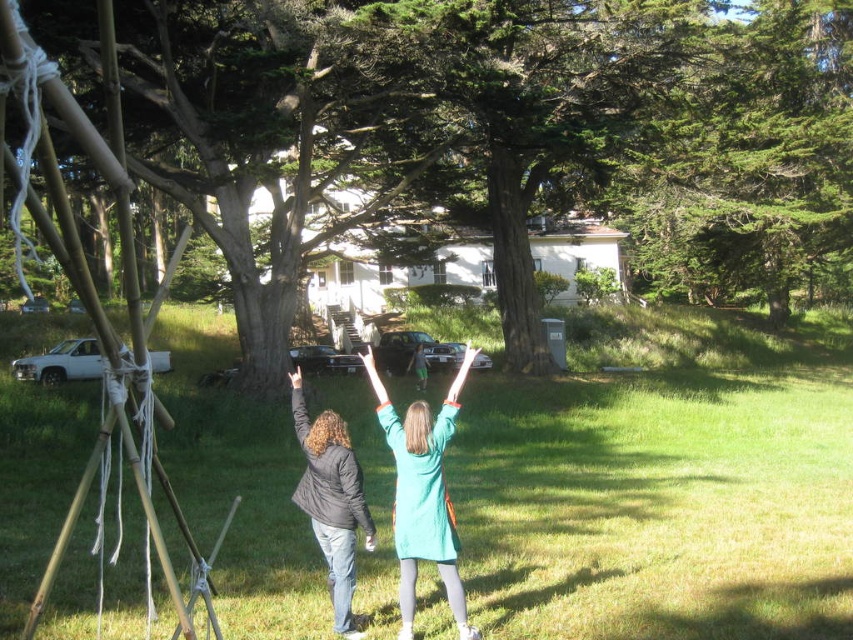
You are standing at the edge of the grassy lawn in the scene. If you walk straight towards the center of the image, will you step onto the green grass at center?

Yes, because the green grass at center is located at point (663, 493), which is the center of the image.

You are a photographer standing behind the two people in the scene. You want to take a photo where the green grass at center is in focus while the matte black jacket at center is slightly blurred. Is this possible given their positions?

Yes, since the green grass at center is closer to you than the matte black jacket at center, you can adjust the camera focus to prioritize the grass, making the jacket appear blurred in the background.

Based on the scene description, where is the green grass at center located in terms of its 2D coordinates?

The green grass at center is located at the 2D coordinates of point (663, 493).